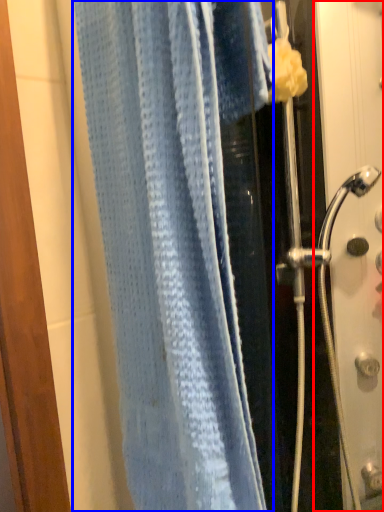
Question: Among these objects, which one is farthest to the camera, screen door (highlighted by a red box) or towel (highlighted by a blue box)?

Choices:
 (A) screen door
 (B) towel

Answer: (A)